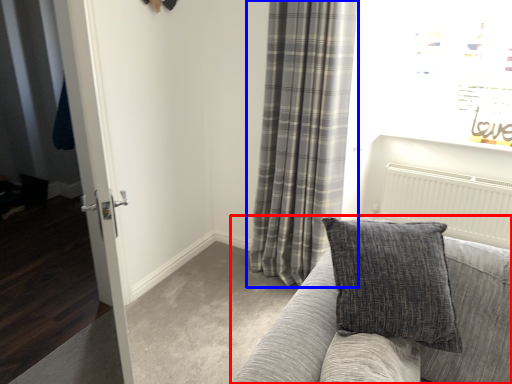
Question: Among these objects, which one is farthest to the camera, studio couch (highlighted by a red box) or curtain (highlighted by a blue box)?

Choices:
 (A) studio couch
 (B) curtain

Answer: (B)